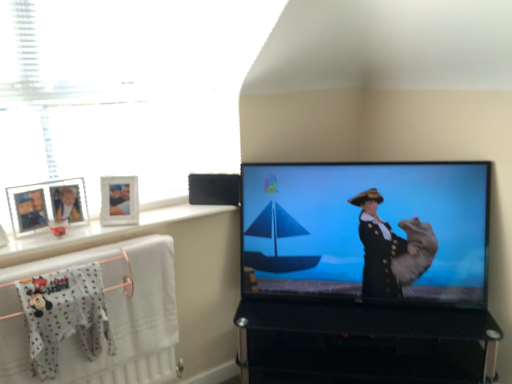
Find the location of a particular element. Image resolution: width=512 pixels, height=384 pixels. free space in front of black plastic speaker at upper center is located at coordinates click(x=207, y=208).